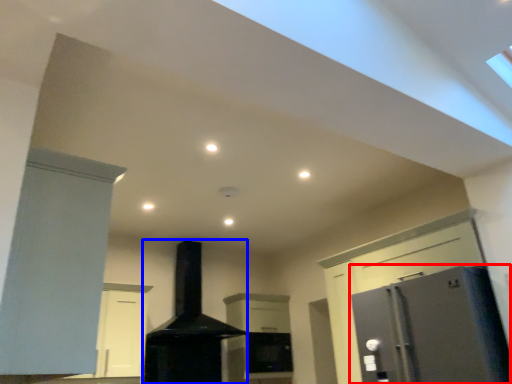
Question: Among these objects, which one is farthest to the camera, refrigerator (highlighted by a red box) or fireplace (highlighted by a blue box)?

Choices:
 (A) refrigerator
 (B) fireplace

Answer: (B)